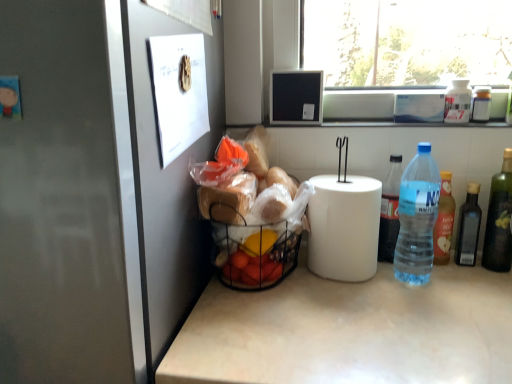
Question: Could you tell me if dark glass bottle at right, placed as the 5th bottle when sorted from left to right, is facing translucent plastic bottle at right, which ranks as the 3th bottle in left-to-right order?

Choices:
 (A) yes
 (B) no

Answer: (B)

Question: Is dark glass bottle at right, positioned as the 3th bottle in right-to-left order, turned away from translucent plastic bottle at right, which ranks as the 3th bottle in left-to-right order?

Choices:
 (A) yes
 (B) no

Answer: (B)

Question: Is dark glass bottle at right, placed as the 5th bottle when sorted from left to right, thinner than translucent plastic bottle at right, marked as the 5th bottle in a right-to-left arrangement?

Choices:
 (A) yes
 (B) no

Answer: (B)

Question: Considering the relative positions of dark glass bottle at right, positioned as the 3th bottle in right-to-left order, and translucent plastic bottle at right, which ranks as the 3th bottle in left-to-right order, in the image provided, is dark glass bottle at right, positioned as the 3th bottle in right-to-left order, to the left of translucent plastic bottle at right, which ranks as the 3th bottle in left-to-right order, from the viewer's perspective?

Choices:
 (A) no
 (B) yes

Answer: (A)

Question: From a real-world perspective, does dark glass bottle at right, placed as the 5th bottle when sorted from left to right, sit lower than translucent plastic bottle at right, which ranks as the 3th bottle in left-to-right order?

Choices:
 (A) yes
 (B) no

Answer: (A)

Question: Is dark glass bottle at right, positioned as the 3th bottle in right-to-left order, positioned far away from translucent plastic bottle at right, which ranks as the 3th bottle in left-to-right order?

Choices:
 (A) no
 (B) yes

Answer: (A)

Question: Is blue plastic bottle at right, which appears as the seventh bottle when viewed from the right, shorter than white plastic bottle at upper right, positioned as the fourth bottle in left-to-right order?

Choices:
 (A) no
 (B) yes

Answer: (A)

Question: Is blue plastic bottle at right, the 1th bottle when ordered from left to right, to the left of white plastic bottle at upper right, acting as the fourth bottle starting from the right, from the viewer's perspective?

Choices:
 (A) no
 (B) yes

Answer: (B)

Question: Is blue plastic bottle at right, which appears as the seventh bottle when viewed from the right, looking in the opposite direction of white plastic bottle at upper right, positioned as the fourth bottle in left-to-right order?

Choices:
 (A) yes
 (B) no

Answer: (B)

Question: From a real-world perspective, is blue plastic bottle at right, which appears as the seventh bottle when viewed from the right, on white plastic bottle at upper right, acting as the fourth bottle starting from the right?

Choices:
 (A) no
 (B) yes

Answer: (A)

Question: Is blue plastic bottle at right, the 1th bottle when ordered from left to right, outside of white plastic bottle at upper right, acting as the fourth bottle starting from the right?

Choices:
 (A) no
 (B) yes

Answer: (B)

Question: Does blue plastic bottle at right, the 1th bottle when ordered from left to right, have a greater width compared to white plastic bottle at upper right, positioned as the fourth bottle in left-to-right order?

Choices:
 (A) yes
 (B) no

Answer: (A)

Question: From a real-world perspective, does green glass bottle at right, which ranks as the seventh bottle in left-to-right order, stand above clear plastic bottle at right, marked as the sixth bottle in a right-to-left arrangement?

Choices:
 (A) yes
 (B) no

Answer: (B)